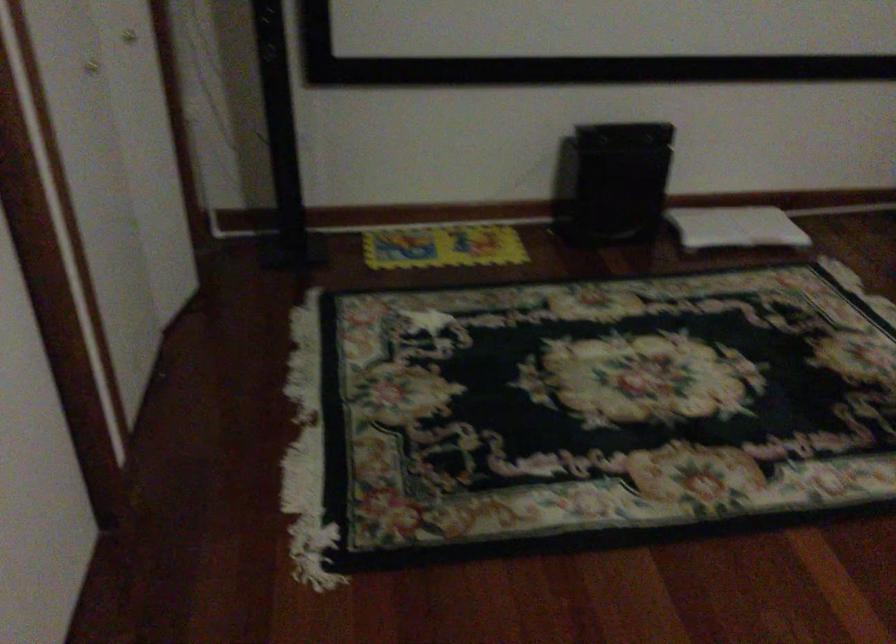
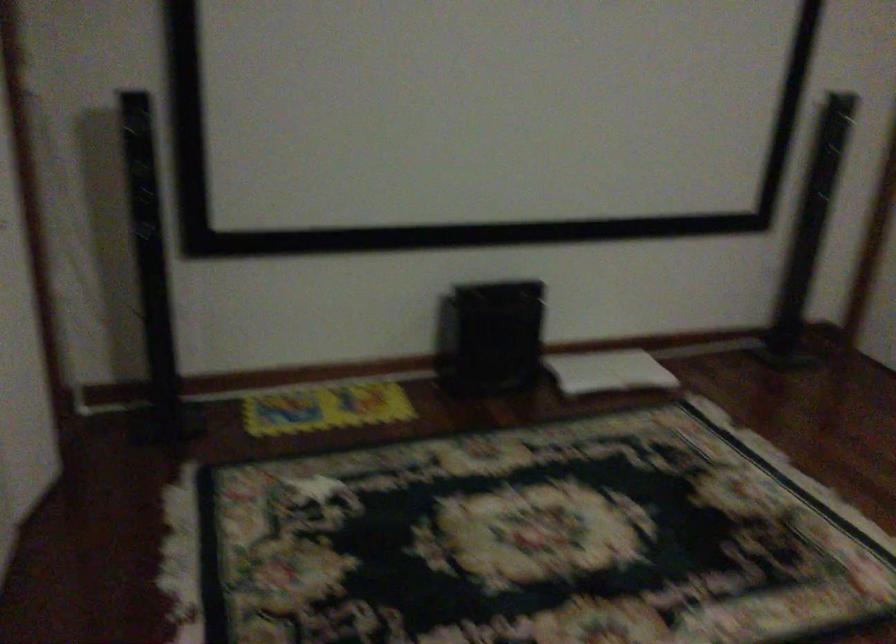
Question: The images are taken continuously from a first-person perspective. In which direction are you moving?

Choices:
 (A) Left
 (B) Right
 (C) Forward
 (D) Backward

Answer: (A)